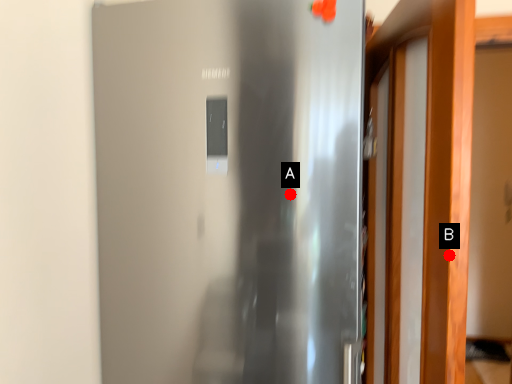
Question: Two points are circled on the image, labeled by A and B beside each circle. Which of the following is the farthest from the observer?

Choices:
 (A) A is further
 (B) B is further

Answer: (A)